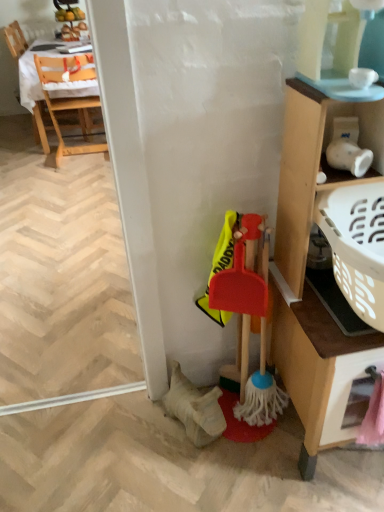
This screenshot has width=384, height=512. What are the coordinates of `pink plastic drawer at lower right` in the screenshot? It's located at (349, 395).

This screenshot has width=384, height=512. What do you see at coordinates (349, 395) in the screenshot?
I see `pink plastic drawer at lower right` at bounding box center [349, 395].

The height and width of the screenshot is (512, 384). What are the coordinates of `rubberized plastic broom at lower right` in the screenshot? It's located at (249, 323).

In order to click on wooden chair at upper left, the 2th chair viewed from the right in this screenshot , I will do `click(15, 40)`.

What do you see at coordinates (70, 99) in the screenshot? I see `wooden chair at left, the 1th chair positioned from the right` at bounding box center [70, 99].

You are a GUI agent. You are given a task and a screenshot of the screen. Output one action in this format:
    pyautogui.click(x=<x>, y=<y>)
    Task: Click on the transparent plastic screen door at lower right
    The width and height of the screenshot is (384, 512).
    Given the screenshot: What is the action you would take?
    pyautogui.click(x=61, y=279)

Considering the sizes of objects rubberized plastic broom at lower right and pink plastic drawer at lower right in the image provided, who is bigger, rubberized plastic broom at lower right or pink plastic drawer at lower right?

Bigger between the two is rubberized plastic broom at lower right.

From the image's perspective, between rubberized plastic broom at lower right and pink plastic drawer at lower right, which one is located above?

rubberized plastic broom at lower right is shown above in the image.

Identify the location of drawer lying behind the rubberized plastic broom at lower right. This screenshot has width=384, height=512. (349, 395).

From a real-world perspective, is wooden cabinet at right physically located above or below wooden chair at left, the 1th chair positioned from the right?

From a real-world perspective, wooden cabinet at right is physically above wooden chair at left, the 1th chair positioned from the right.

Is wooden cabinet at right oriented towards wooden chair at left, the second chair viewed from the left?

No, wooden cabinet at right does not turn towards wooden chair at left, the second chair viewed from the left.

Which object is thinner, wooden cabinet at right or wooden chair at left, the second chair viewed from the left?

With smaller width is wooden cabinet at right.

Based on their positions, is wooden cabinet at right located to the left or right of wooden chair at upper left, acting as the 1th chair starting from the left?

From the image, it's evident that wooden cabinet at right is to the right of wooden chair at upper left, acting as the 1th chair starting from the left.

Could you tell me if wooden cabinet at right is turned towards wooden chair at upper left, acting as the 1th chair starting from the left?

No, wooden cabinet at right is not facing towards wooden chair at upper left, acting as the 1th chair starting from the left.

Considering the relative sizes of wooden cabinet at right and wooden chair at upper left, the 2th chair viewed from the right, in the image provided, is wooden cabinet at right thinner than wooden chair at upper left, the 2th chair viewed from the right,?

Yes, wooden cabinet at right is thinner than wooden chair at upper left, the 2th chair viewed from the right.

Is wooden chair at left, the 1th chair positioned from the right, outside of wooden cabinet at right?

Yes, wooden chair at left, the 1th chair positioned from the right, is outside of wooden cabinet at right.

Considering the sizes of objects wooden chair at left, the 1th chair positioned from the right, and wooden cabinet at right in the image provided, who is shorter, wooden chair at left, the 1th chair positioned from the right, or wooden cabinet at right?

With less height is wooden chair at left, the 1th chair positioned from the right.

Does point (104, 147) lie behind point (279, 186)?

Yes, point (104, 147) is behind point (279, 186).

The height and width of the screenshot is (512, 384). What are the coordinates of `screen door beneath the wooden chair at left, the 1th chair positioned from the right (from a real-world perspective)` in the screenshot? It's located at tap(61, 279).

Looking at this image, is wooden chair at left, the second chair viewed from the left, bigger or smaller than transparent plastic screen door at lower right?

Considering their sizes, wooden chair at left, the second chair viewed from the left, takes up less space than transparent plastic screen door at lower right.

Which object is positioned more to the left, wooden chair at left, the 1th chair positioned from the right, or transparent plastic screen door at lower right?

transparent plastic screen door at lower right is more to the left.

Is wooden chair at left, the second chair viewed from the left, completely or partially outside of transparent plastic screen door at lower right?

That's correct, wooden chair at left, the second chair viewed from the left, is outside of transparent plastic screen door at lower right.

Would you say transparent plastic screen door at lower right is to the left or to the right of wooden cabinet at right in the picture?

transparent plastic screen door at lower right is positioned on wooden cabinet at right's left side.

How distant is transparent plastic screen door at lower right from wooden cabinet at right?

transparent plastic screen door at lower right is 4.09 feet from wooden cabinet at right.

From the image's perspective, which is below, transparent plastic screen door at lower right or wooden cabinet at right?

wooden cabinet at right is shown below in the image.

From a real-world perspective, who is located lower, transparent plastic screen door at lower right or wooden cabinet at right?

transparent plastic screen door at lower right, from a real-world perspective.

Based on their sizes in the image, would you say transparent plastic screen door at lower right is bigger or smaller than wooden chair at upper left, the 2th chair viewed from the right?

In the image, transparent plastic screen door at lower right appears to be larger than wooden chair at upper left, the 2th chair viewed from the right.

Is transparent plastic screen door at lower right located outside wooden chair at upper left, the 2th chair viewed from the right?

That's correct, transparent plastic screen door at lower right is outside of wooden chair at upper left, the 2th chair viewed from the right.

I want to click on screen door below the wooden chair at upper left, acting as the 1th chair starting from the left (from the image's perspective), so click(61, 279).

This screenshot has width=384, height=512. Find the location of `drawer behind the rubberized plastic broom at lower right`. drawer behind the rubberized plastic broom at lower right is located at coordinates (349, 395).

You are a GUI agent. You are given a task and a screenshot of the screen. Output one action in this format:
    pyautogui.click(x=<x>, y=<y>)
    Task: Click on the 2nd chair positioned below the wooden cabinet at right (from a real-world perspective)
    This screenshot has width=384, height=512.
    Given the screenshot: What is the action you would take?
    pyautogui.click(x=70, y=99)

When comparing their distances from pink plastic drawer at lower right, does rubberized plastic broom at lower right or wooden chair at left, the 1th chair positioned from the right, seem further?

wooden chair at left, the 1th chair positioned from the right, is positioned further to the anchor pink plastic drawer at lower right.

Considering their positions, is pink plastic drawer at lower right positioned closer to rubberized plastic broom at lower right than wooden chair at upper left, acting as the 1th chair starting from the left?

pink plastic drawer at lower right is positioned closer to the anchor rubberized plastic broom at lower right.

Considering their positions, is wooden chair at left, the 1th chair positioned from the right, positioned further to pink plastic drawer at lower right than transparent plastic screen door at lower right?

wooden chair at left, the 1th chair positioned from the right, lies further to pink plastic drawer at lower right than the other object.

Estimate the real-world distances between objects in this image. Which object is closer to wooden chair at upper left, acting as the 1th chair starting from the left, transparent plastic screen door at lower right or rubberized plastic broom at lower right?

Based on the image, transparent plastic screen door at lower right appears to be nearer to wooden chair at upper left, acting as the 1th chair starting from the left.

Which object lies further to the anchor point rubberized plastic broom at lower right, wooden cabinet at right or wooden chair at left, the second chair viewed from the left?

wooden chair at left, the second chair viewed from the left, lies further to rubberized plastic broom at lower right than the other object.

When comparing their distances from wooden chair at upper left, acting as the 1th chair starting from the left, does rubberized plastic broom at lower right or wooden cabinet at right seem further?

Based on the image, wooden cabinet at right appears to be further to wooden chair at upper left, acting as the 1th chair starting from the left.

Looking at the image, which one is located further to wooden cabinet at right, wooden chair at upper left, the 2th chair viewed from the right, or pink plastic drawer at lower right?

wooden chair at upper left, the 2th chair viewed from the right.

When comparing their distances from pink plastic drawer at lower right, does wooden chair at upper left, the 2th chair viewed from the right, or rubberized plastic broom at lower right seem closer?

Based on the image, rubberized plastic broom at lower right appears to be nearer to pink plastic drawer at lower right.

This screenshot has width=384, height=512. Find the location of `screen door between pink plastic drawer at lower right and wooden chair at upper left, acting as the 1th chair starting from the left, in the front-back direction`. screen door between pink plastic drawer at lower right and wooden chair at upper left, acting as the 1th chair starting from the left, in the front-back direction is located at coordinates (61, 279).

Where is `cabinetry between transparent plastic screen door at lower right and pink plastic drawer at lower right`? The image size is (384, 512). cabinetry between transparent plastic screen door at lower right and pink plastic drawer at lower right is located at coordinates (306, 261).

This screenshot has height=512, width=384. Find the location of `toy between transparent plastic screen door at lower right and pink plastic drawer at lower right in the horizontal direction`. toy between transparent plastic screen door at lower right and pink plastic drawer at lower right in the horizontal direction is located at coordinates (249, 323).

Where is `cabinetry located between rubberized plastic broom at lower right and pink plastic drawer at lower right in the left-right direction`? cabinetry located between rubberized plastic broom at lower right and pink plastic drawer at lower right in the left-right direction is located at coordinates (306, 261).